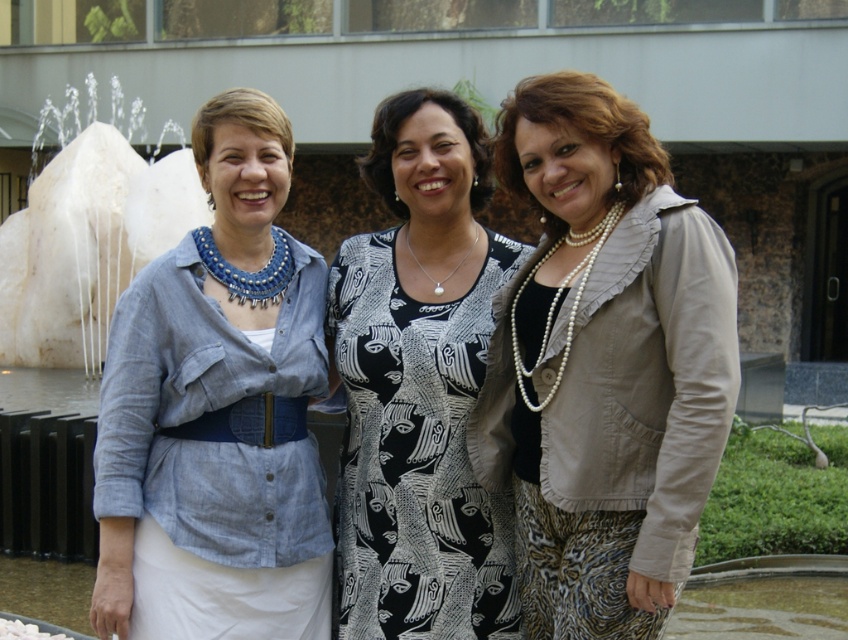
You are a fashion designer observing the women in the image. The pearl fabric jacket at center and the black printed fabric dress at center are part of a layered outfit. Which piece is worn on top?

The pearl fabric jacket at center is positioned over the black printed fabric dress at center, so the pearl fabric jacket at center is the top layer.

You are standing in front of the modern building and want to determine which of the two points, point (444, 538) or point (70, 172), is closer to you. Based on the scene description, which point is nearer?

Point (444, 538) is closer to the viewer than point (70, 172).